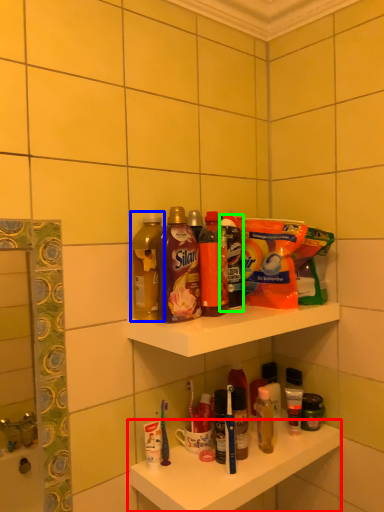
Question: Which object is the farthest from shelf (highlighted by a red box)? Choose among these: bottle (highlighted by a blue box) or cleaning product (highlighted by a green box).

Choices:
 (A) bottle
 (B) cleaning product

Answer: (A)